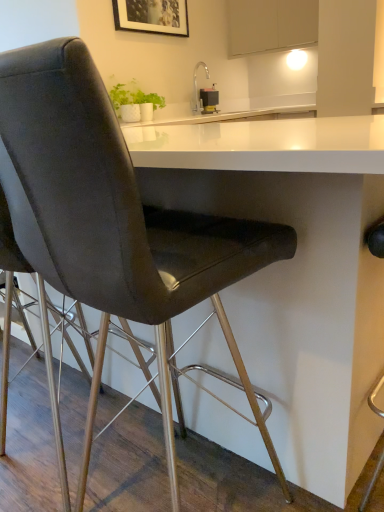
Measure the distance between wooden picture frame at upper center and camera.

The depth of wooden picture frame at upper center is 8.90 feet.

What do you see at coordinates (209, 99) in the screenshot?
I see `metallic rectangular device at upper center` at bounding box center [209, 99].

What are the coordinates of `satin nickel faucet at upper center` in the screenshot? It's located at (196, 84).

Where is `matte black chair at left`? The image size is (384, 512). matte black chair at left is located at coordinates (114, 221).

Find the location of a particular element. This screenshot has height=512, width=384. wooden picture frame at upper center is located at coordinates (152, 16).

Is white matte cabinet at upper center positioned far away from wooden picture frame at upper center?

Actually, white matte cabinet at upper center and wooden picture frame at upper center are a little close together.

Is white matte cabinet at upper center positioned with its back to wooden picture frame at upper center?

white matte cabinet at upper center does not have its back to wooden picture frame at upper center.

Is white matte cabinet at upper center inside the boundaries of wooden picture frame at upper center, or outside?

white matte cabinet at upper center is spatially situated outside wooden picture frame at upper center.

Considering the positions of objects matte black chair at left and white matte cabinet at upper center in the image provided, who is more to the right, matte black chair at left or white matte cabinet at upper center?

white matte cabinet at upper center.

Looking at this image, are matte black chair at left and white matte cabinet at upper center located far from each other?

Indeed, matte black chair at left is not near white matte cabinet at upper center.

From the image's perspective, is matte black chair at left on top of white matte cabinet at upper center?

No.

Can white matte cabinet at upper center be found inside satin nickel faucet at upper center?

Definitely not — white matte cabinet at upper center is not inside satin nickel faucet at upper center.

Is satin nickel faucet at upper center in front of or behind white matte cabinet at upper center in the image?

satin nickel faucet at upper center is behind white matte cabinet at upper center.

Between point (205, 69) and point (229, 51), which one is positioned in front?

The point (205, 69) is closer to the camera.

Is matte black chair at left positioned far away from white glossy table at center?

No, matte black chair at left is not far from white glossy table at center.

Based on the photo, can you confirm if matte black chair at left is taller than white glossy table at center?

Yes, matte black chair at left is taller than white glossy table at center.

Considering the relative sizes of matte black chair at left and white glossy table at center in the image provided, is matte black chair at left wider than white glossy table at center?

Incorrect, the width of matte black chair at left does not surpass that of white glossy table at center.

Which is closer to the camera, [106,304] or [204,435]?

Point [106,304].

Is satin nickel faucet at upper center oriented towards wooden picture frame at upper center?

No, satin nickel faucet at upper center is not aimed at wooden picture frame at upper center.

Could wooden picture frame at upper center be considered to be inside satin nickel faucet at upper center?

No, wooden picture frame at upper center is not a part of satin nickel faucet at upper center.

Looking at this image, can you confirm if satin nickel faucet at upper center is smaller than wooden picture frame at upper center?

Correct, satin nickel faucet at upper center occupies less space than wooden picture frame at upper center.

From the image's perspective, would you say satin nickel faucet at upper center is shown under wooden picture frame at upper center?

Yes.

Where is `cabinetry above the white glossy table at center (from the image's perspective)`? This screenshot has width=384, height=512. cabinetry above the white glossy table at center (from the image's perspective) is located at coordinates (271, 25).

From the image's perspective, is white matte cabinet at upper center located beneath white glossy table at center?

No, from the image's perspective, white matte cabinet at upper center is not below white glossy table at center.

From a real-world perspective, who is located lower, white matte cabinet at upper center or white glossy table at center?

white glossy table at center is physically lower.

Considering the positions of objects white matte cabinet at upper center and white glossy table at center in the image provided, who is more to the left, white matte cabinet at upper center or white glossy table at center?

white glossy table at center.

Are white matte cabinet at upper center and matte black chair at left beside each other?

No.

Which of these two, white matte cabinet at upper center or matte black chair at left, stands shorter?

white matte cabinet at upper center is shorter.

Which object is closer to the camera, white matte cabinet at upper center or matte black chair at left?

matte black chair at left is closer to the camera.

Can you confirm if white matte cabinet at upper center is positioned to the right of matte black chair at left?

Yes, white matte cabinet at upper center is to the right of matte black chair at left.

Where is `picture frame above the white matte cabinet at upper center (from a real-world perspective)`? The width and height of the screenshot is (384, 512). picture frame above the white matte cabinet at upper center (from a real-world perspective) is located at coordinates (152, 16).

Identify the location of chair located below the white matte cabinet at upper center (from the image's perspective). (114, 221).

Estimate the real-world distances between objects in this image. Which object is closer to metallic rectangular device at upper center, white matte cabinet at upper center or satin nickel faucet at upper center?

satin nickel faucet at upper center is positioned closer to the anchor metallic rectangular device at upper center.

From the image, which object appears to be nearer to wooden picture frame at upper center, metallic rectangular device at upper center or white glossy table at center?

metallic rectangular device at upper center.

From the image, which object appears to be farther from white matte cabinet at upper center, matte black chair at left or wooden picture frame at upper center?

matte black chair at left is further to white matte cabinet at upper center.

Estimate the real-world distances between objects in this image. Which object is further from white glossy table at center, satin nickel faucet at upper center or wooden picture frame at upper center?

Based on the image, satin nickel faucet at upper center appears to be further to white glossy table at center.

Considering their positions, is metallic rectangular device at upper center positioned closer to wooden picture frame at upper center than matte black chair at left?

Based on the image, metallic rectangular device at upper center appears to be nearer to wooden picture frame at upper center.

Looking at the image, which one is located closer to wooden picture frame at upper center, matte black chair at left or satin nickel faucet at upper center?

satin nickel faucet at upper center is positioned closer to the anchor wooden picture frame at upper center.

Based on their spatial positions, is wooden picture frame at upper center or white glossy table at center further from matte black chair at left?

wooden picture frame at upper center is further to matte black chair at left.

Considering their positions, is matte black chair at left positioned further to satin nickel faucet at upper center than white matte cabinet at upper center?

Based on the image, matte black chair at left appears to be further to satin nickel faucet at upper center.

Locate an element on the screen. cabinetry between matte black chair at left and metallic rectangular device at upper center in the front-back direction is located at coordinates (271, 25).

The width and height of the screenshot is (384, 512). I want to click on picture frame between matte black chair at left and satin nickel faucet at upper center from front to back, so click(x=152, y=16).

Find the location of a particular element. The height and width of the screenshot is (512, 384). faucet located between matte black chair at left and metallic rectangular device at upper center in the depth direction is located at coordinates (196, 84).

Identify the location of cabinetry located between white glossy table at center and metallic rectangular device at upper center in the depth direction. This screenshot has height=512, width=384. (271, 25).